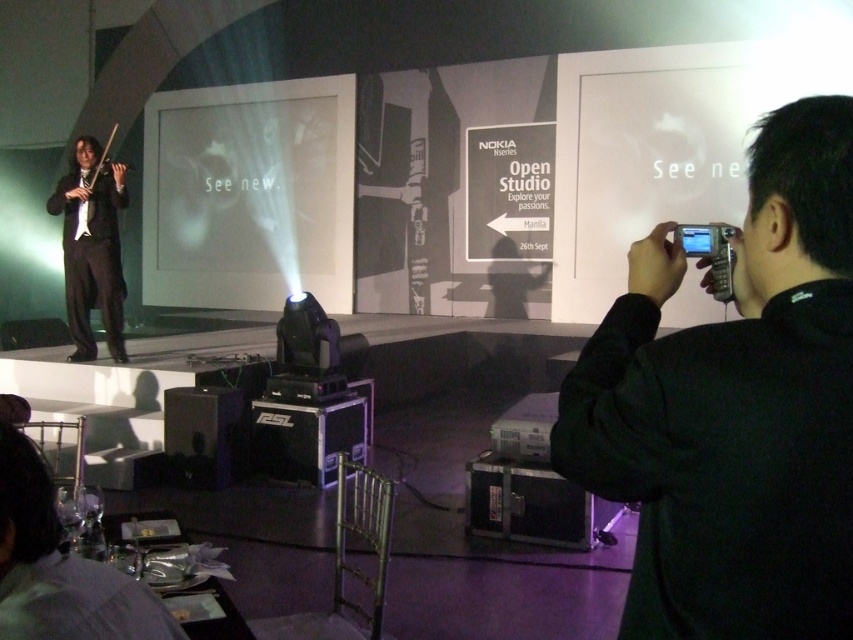
You are an event photographer positioned at the center of the stage. You need to capture a closeup shot of the violinist on the left side of the stage. To do this, you must adjust your camera, which is the black fabric camera at right. Where should you point your camera relative to the violinist?

The black fabric camera at right is located at point (735, 408), so you should point the camera towards the violinist on the left side of the stage to capture the closeup shot.

You are attending the Nokia Open Studio event and want to take a photo of the violinist wearing the matte black suit at left. However, there is a black fabric camera at right in your way. Can you still take the photo without moving the camera?

The black fabric camera at right is closer to the viewer than the matte black suit at left, so the camera is blocking the view. You cannot take the photo without moving the camera.

You are a photographer at the Nokia event and need to capture a closeup shot of the violinist. The black fabric camera at right and black plastic speaker at lower center are in your way. Which object should you move to get a clearer view of the violinist?

The black fabric camera at right is positioned over the black plastic speaker at lower center. To get a clearer view of the violinist, you should move the black fabric camera at right since it is closer to your line of sight being above the speaker.